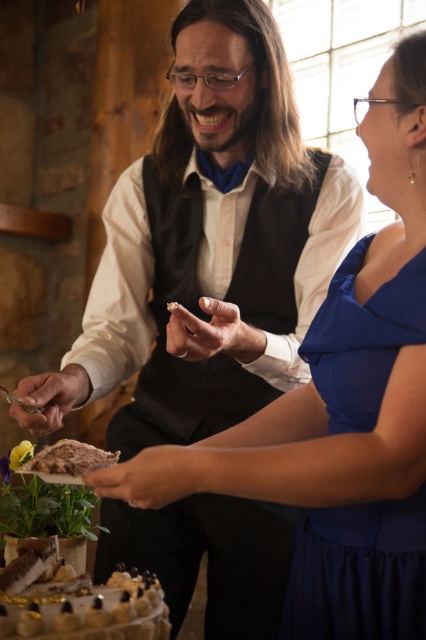
Does chocolate frosted cake at lower left appear on the left side of brown crumbly cake at lower left?

No, chocolate frosted cake at lower left is not to the left of brown crumbly cake at lower left.

Is point (32, 628) less distant than point (117, 451)?

Yes, it is.

Describe the element at coordinates (77, 602) in the screenshot. This screenshot has width=426, height=640. I see `chocolate frosted cake at lower left` at that location.

Identify the location of chocolate frosted cake at lower left. (77, 602).